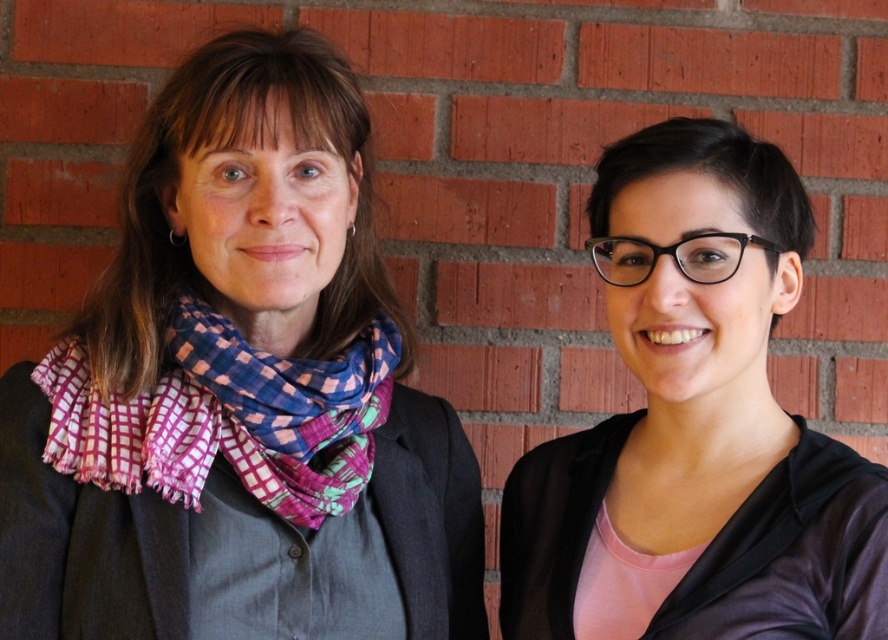
You are a photographer trying to capture a closeup of the multicolored woven scarf at center. Given that your camera has a 10cm focal length, can you determine if the scarf is within the camera frame? The camera frame is 12cm wide and centered at point (239, 392).

The multicolored woven scarf at center is located exactly at point (239, 392), which is the center of the camera frame. Since the camera frame is 12cm wide, the scarf is well within the frame and can be captured clearly.

You are a photographer trying to capture a closeup of the black glossy glasses at upper right and the multicolored woven scarf at left. Since you want to focus on both objects equally, which one should you adjust the camera focus for first?

The black glossy glasses at upper right is taller than the multicolored woven scarf at left, so you should focus on the black glossy glasses at upper right first to ensure it is in frame before adjusting for the smaller object.

You are a photographer trying to capture a closeup of the multicolored woven scarf at center and the multicolored woven scarf at left. Which scarf should you focus on first if you want to photograph them from top to bottom?

The multicolored woven scarf at center should be focused on first because it is located above the multicolored woven scarf at left.